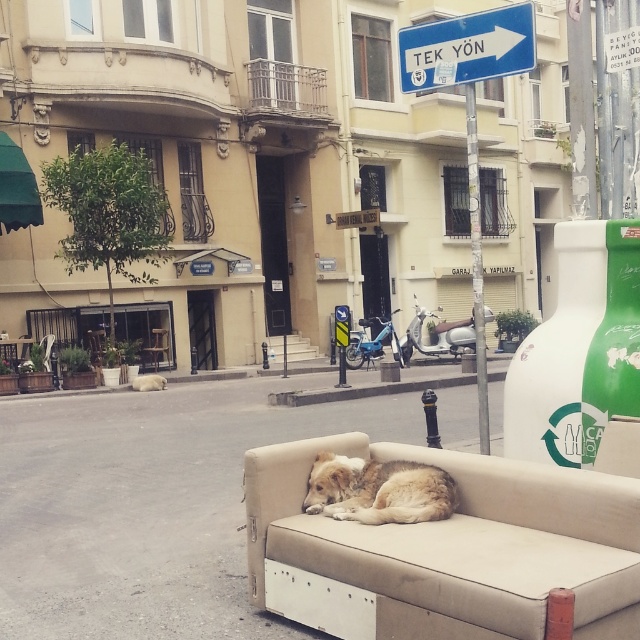
Which is more to the right, golden fur dog at center or gray concrete curb at center?

From the viewer's perspective, golden fur dog at center appears more on the right side.

Does point (432, 490) come behind point (362, 396)?

No.

The width and height of the screenshot is (640, 640). Identify the location of golden fur dog at center. (378, 490).

Is beige fabric couch at center to the right of golden fur dog at center from the viewer's perspective?

Indeed, beige fabric couch at center is positioned on the right side of golden fur dog at center.

Who is lower down, beige fabric couch at center or golden fur dog at center?

beige fabric couch at center is lower down.

Between point (544, 605) and point (376, 490), which one is positioned behind?

Point (376, 490)

At what (x,y) coordinates should I click in order to perform the action: click on beige fabric couch at center. Please return your answer as a coordinate pair (x, y). This screenshot has height=640, width=640. Looking at the image, I should click on (445, 550).

Based on the photo, who is taller, blue plastic sign at upper center or gray concrete curb at center?

With more height is blue plastic sign at upper center.

Is blue plastic sign at upper center shorter than gray concrete curb at center?

No, blue plastic sign at upper center is not shorter than gray concrete curb at center.

Describe the element at coordinates (467, 49) in the screenshot. Image resolution: width=640 pixels, height=640 pixels. I see `blue plastic sign at upper center` at that location.

Find the location of a particular element. Image resolution: width=640 pixels, height=640 pixels. blue plastic sign at upper center is located at coordinates [467, 49].